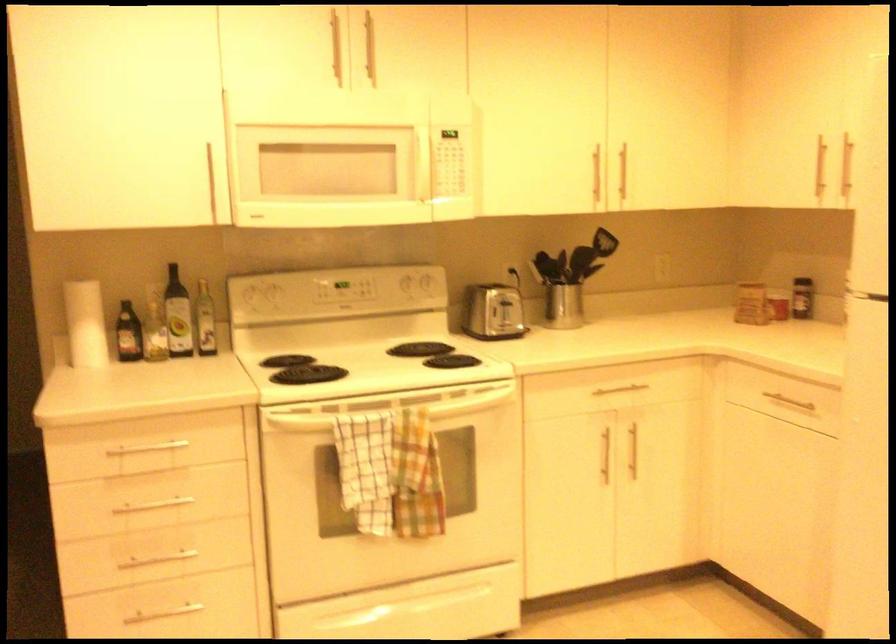
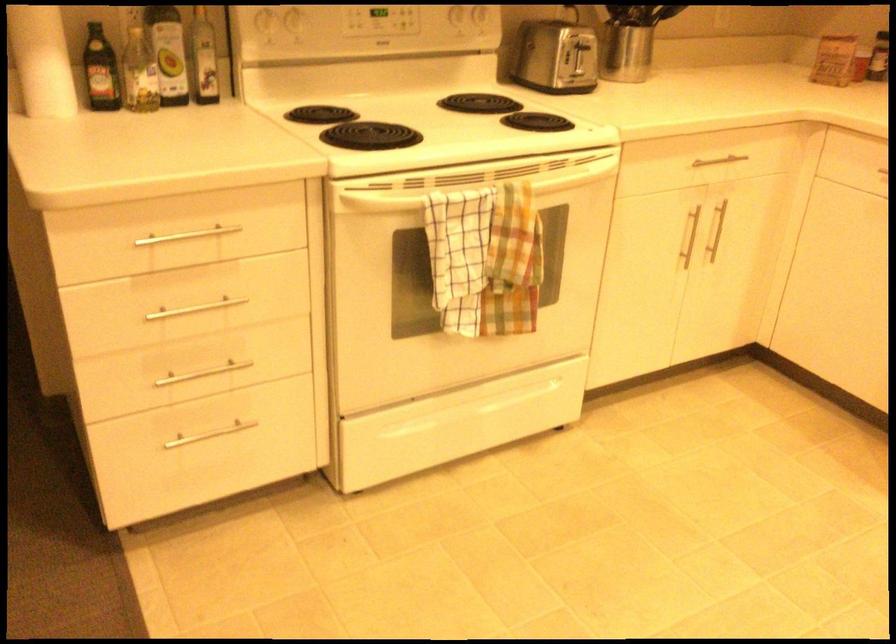
Where in the second image is the point corresponding to point (123, 339) from the first image?

(100, 71)